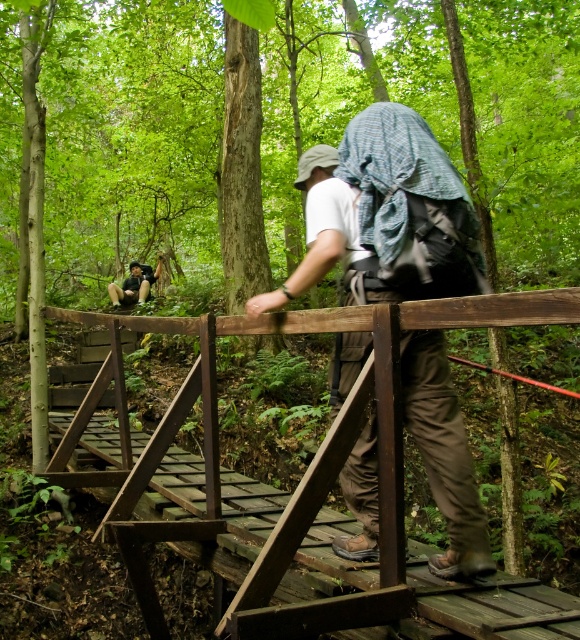
The height and width of the screenshot is (640, 580). Describe the element at coordinates (380, 214) in the screenshot. I see `matte black backpack at center` at that location.

Does matte black backpack at center come in front of rustic wooden bridge at center?

That is False.

Who is more forward, (321, 189) or (296, 486)?

Positioned in front is point (321, 189).

This screenshot has width=580, height=640. Find the location of `matte black backpack at center`. matte black backpack at center is located at coordinates (380, 214).

Who is positioned more to the left, rustic wooden bridge at center or matte black backpack at lower left?

Positioned to the left is matte black backpack at lower left.

Is point (545, 305) closer to camera compared to point (126, 291)?

Yes, it is.

Where is `rustic wooden bridge at center`? rustic wooden bridge at center is located at coordinates click(x=314, y=454).

I want to click on rustic wooden bridge at center, so click(x=314, y=454).

Who is shorter, matte black backpack at center or matte black backpack at lower left?

matte black backpack at lower left

Who is lower down, matte black backpack at center or matte black backpack at lower left?

matte black backpack at center is below.

Does point (422, 157) come farther from viewer compared to point (153, 280)?

No, (422, 157) is closer to viewer.

This screenshot has height=640, width=580. What are the coordinates of `matte black backpack at center` in the screenshot? It's located at (380, 214).